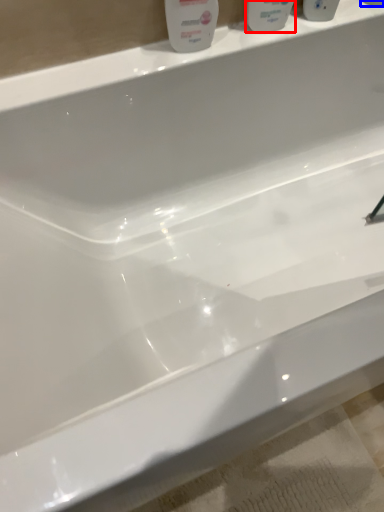
Question: Which object is closer to the camera taking this photo, mouthwash (highlighted by a red box) or mouthwash (highlighted by a blue box)?

Choices:
 (A) mouthwash
 (B) mouthwash

Answer: (A)